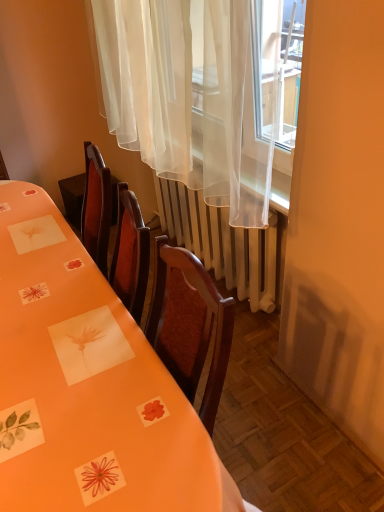
Question: Relative to sheer white curtain at upper center, is white metallic radiator at center in front or behind?

Choices:
 (A) front
 (B) behind

Answer: (B)

Question: Is point (205, 210) closer or farther from the camera than point (235, 4)?

Choices:
 (A) closer
 (B) farther

Answer: (B)

Question: Which object is the farthest from the white metallic radiator at center?

Choices:
 (A) sheer white curtain at upper center
 (B) orange paper table at center

Answer: (B)

Question: Estimate the real-world distances between objects in this image. Which object is closer to the white metallic radiator at center?

Choices:
 (A) orange paper table at center
 (B) sheer white curtain at upper center

Answer: (B)